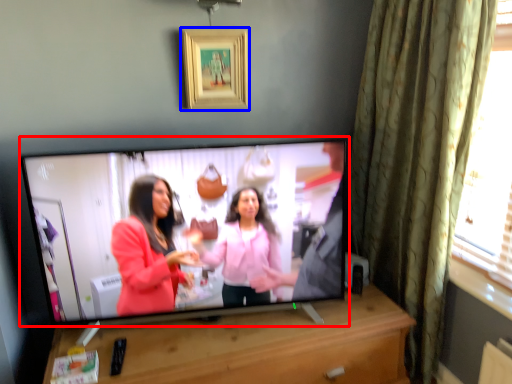
Question: Which object is further to the camera taking this photo, television (highlighted by a red box) or picture frame (highlighted by a blue box)?

Choices:
 (A) television
 (B) picture frame

Answer: (B)